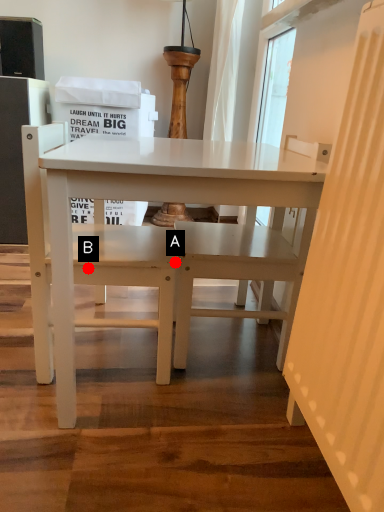
Question: Two points are circled on the image, labeled by A and B beside each circle. Which point appears farthest from the camera in this image?

Choices:
 (A) A is further
 (B) B is further

Answer: (A)